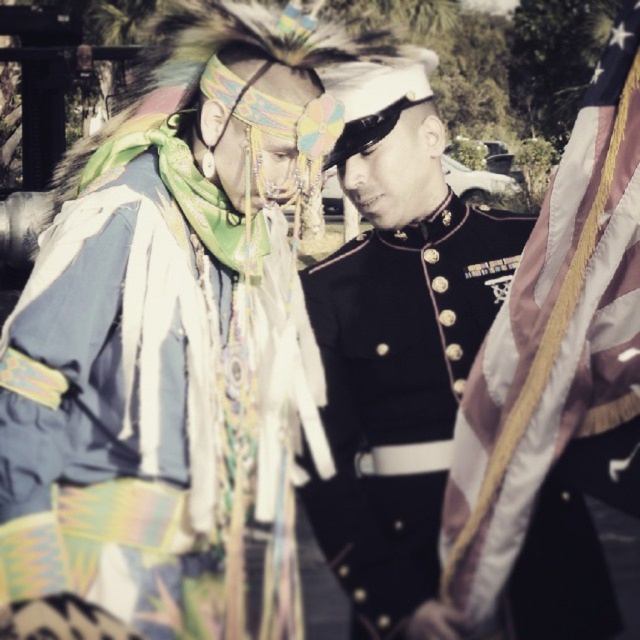
You are a photographer positioned at the center of the scene. The textured fabric headdress at upper left and the formal military uniform on the right are in your view. Which object is closer to the top edge of the image?

The textured fabric headdress at upper left is closer to the top edge of the image because its coordinates are at point 0.272 vertically, which is higher than the position of the formal military uniform on the right.

Looking at this image, you are a photographer standing 2 feet away from the black polished uniform at center. You want to take a photo of the textured fabric headdress at upper left without moving your position. Is the headdress within your camera lens range if your camera can capture objects up to 24 inches away?

The distance between the textured fabric headdress at upper left and the black polished uniform at center is 18.93 inches. Since you are 2 feet away from the uniform, the total distance to the headdress would be 2 feet plus 18.93 inches. Converting 2 feet to inches gives 24 inches. Adding 18.93 inches results in 42.93 inches, which exceeds the camera lens range of 24 inches. Therefore, the headdress is out of range.

You are a photographer trying to capture the perfect shot of the black polished uniform at center. The camera you are using has a focus point at coordinate point (397, 392). Will the focus point align with the black polished uniform at center?

The black polished uniform at center is located at point (397, 392), so yes, the focus point will align with the black polished uniform at center.